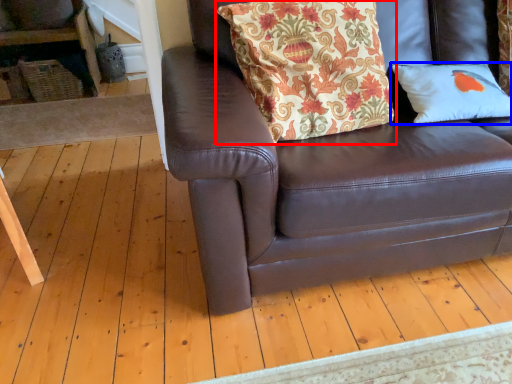
Question: Which of the following is the closest to the observer, pillow (highlighted by a red box) or pillow (highlighted by a blue box)?

Choices:
 (A) pillow
 (B) pillow

Answer: (A)